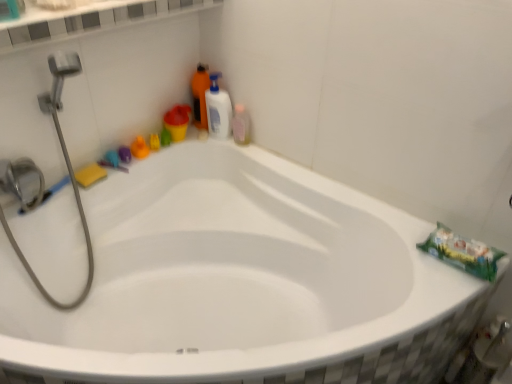
Question: Is white glossy ledge at upper center taller or shorter than orange matte bottle at upper center, which is the 1th cleaning product in left-to-right order?

Choices:
 (A) short
 (B) tall

Answer: (A)

Question: Considering the positions of white glossy ledge at upper center and orange matte bottle at upper center, which is the 1th cleaning product in left-to-right order, in the image, is white glossy ledge at upper center wider or thinner than orange matte bottle at upper center, which is the 1th cleaning product in left-to-right order,?

Choices:
 (A) thin
 (B) wide

Answer: (B)

Question: Which object is positioned closest to the white glossy ledge at upper center?

Choices:
 (A) pink translucent bottle at upper right
 (B) orange matte bottle at upper center, which is the 1th cleaning product in left-to-right order
 (C) white glossy bottle at upper right, the 1th cleaning product positioned from the right
 (D) yellow sponge at upper left

Answer: (C)

Question: Which of these objects is positioned farthest from the orange matte bottle at upper center, which is the 1th cleaning product in left-to-right order?

Choices:
 (A) white glossy ledge at upper center
 (B) yellow sponge at upper left
 (C) white glossy bottle at upper right, the 1th cleaning product positioned from the right
 (D) pink translucent bottle at upper right

Answer: (B)